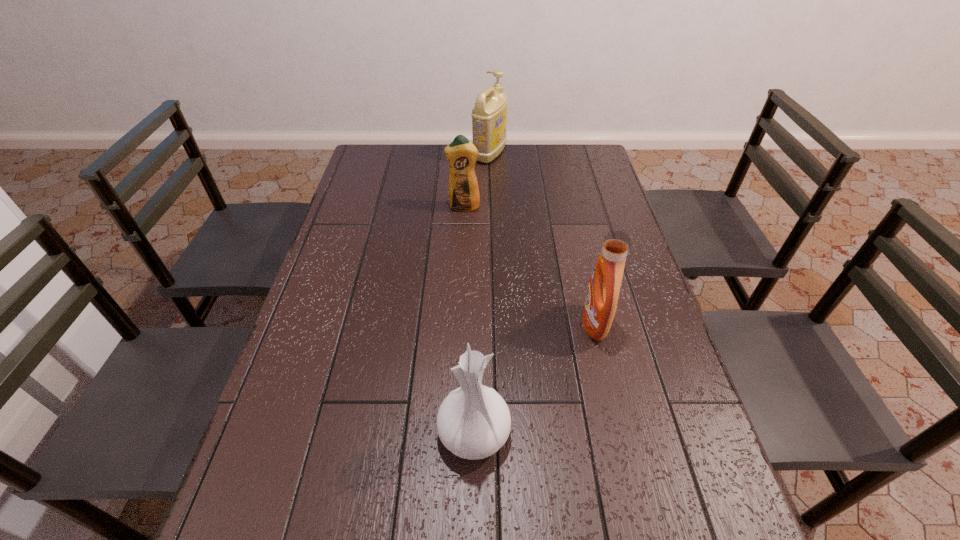
This screenshot has width=960, height=540. I want to click on free region located on the right of the nearest object, so click(598, 432).

Where is `object that is at the far edge`? The image size is (960, 540). object that is at the far edge is located at coordinates (489, 116).

Identify the location of object present at the right edge. (603, 290).

Identify the location of vacant region at the far edge of the desktop. The width and height of the screenshot is (960, 540). (541, 147).

Find the location of a particular element. This screenshot has height=540, width=960. vacant space at the left edge is located at coordinates (373, 211).

In the image, there is a desktop. Where is `vacant space at the right edge`? This screenshot has height=540, width=960. vacant space at the right edge is located at coordinates (593, 213).

This screenshot has width=960, height=540. Find the location of `free space at the far right corner of the desktop`. free space at the far right corner of the desktop is located at coordinates (569, 150).

At what (x,y) coordinates should I click in order to perform the action: click on vacant point located between the nearest object and the second farthest object. Please return your answer as a coordinate pair (x, y). This screenshot has height=540, width=960. Looking at the image, I should click on (468, 320).

Identify the location of empty space between the vase and the third farthest object. (534, 378).

You are a GUI agent. You are given a task and a screenshot of the screen. Output one action in this format:
    pyautogui.click(x=<x>, y=<y>)
    Task: Click on the free spot between the rightmost object and the third nearest object
    The image size is (960, 540).
    Given the screenshot: What is the action you would take?
    pyautogui.click(x=529, y=266)